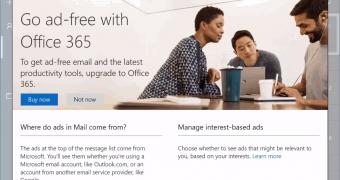
Locate an element on the screen. This screenshot has height=180, width=340. pen is located at coordinates (277, 77).